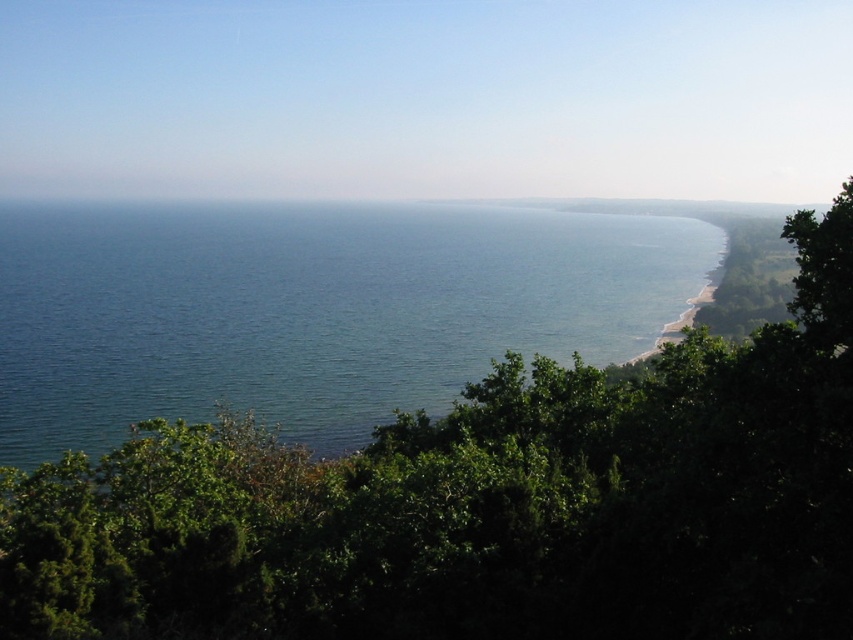
You are standing at the edge of the coastal landscape and want to walk towards the green leafy tree at right. Which direction should you head to first to avoid the blue water at center?

You should head to the right side first to avoid the blue water at center since the blue water at center is positioned on the left side of the green leafy tree at right.

You are a photographer planning to capture the entire scene including the blue water at center and the green leafy tree at right. Given that your camera frame can only accommodate objects of equal size, will you be able to fit both into the frame without cropping either?

The blue water at center has a larger size compared to green leafy tree at right. Since the camera frame requires both objects to be of equal size and the blue water at center is bigger, it may not fit without cropping unless the frame is adjusted to accommodate its larger size.

You are standing on the beach looking at the scene. Which object, the green leafy tree at right or the blue water at center, is closer to you?

The blue water at center is closer to you because the green leafy tree at right is behind it.